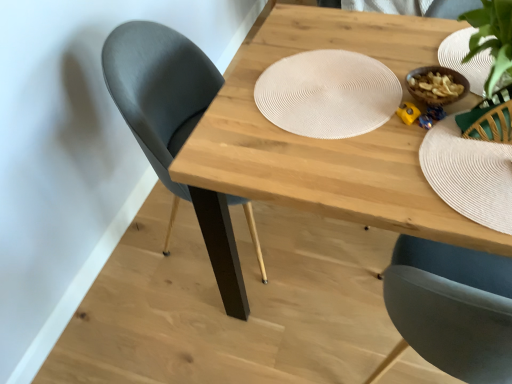
This screenshot has width=512, height=384. In order to click on free space to the left of white woven placemat at center in this screenshot , I will do click(226, 122).